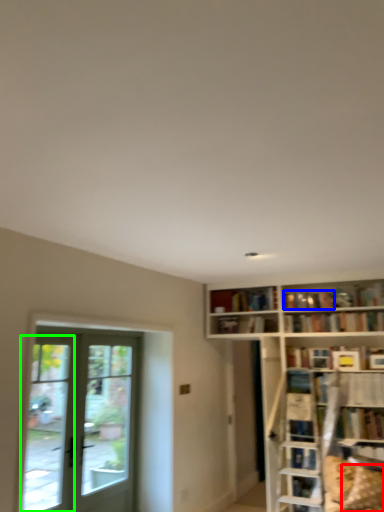
Question: Estimate the real-world distances between objects in this image. Which object is farther from pillow (highlighted by a red box), book (highlighted by a blue box) or window (highlighted by a green box)?

Choices:
 (A) book
 (B) window

Answer: (B)